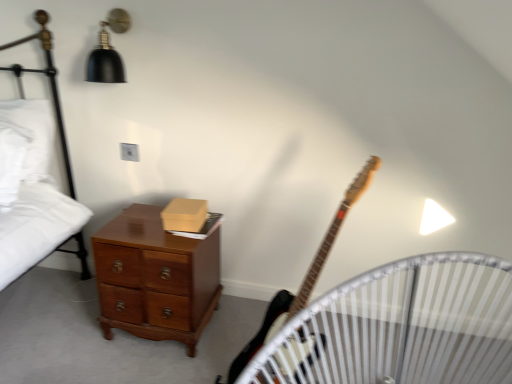
You are a GUI agent. You are given a task and a screenshot of the screen. Output one action in this format:
    pyautogui.click(x=<x>, y=<y>)
    Task: Click on the vacant space to the right of mahogany wooden chest of drawers at lower left
    This screenshot has width=512, height=384.
    Given the screenshot: What is the action you would take?
    pyautogui.click(x=236, y=319)